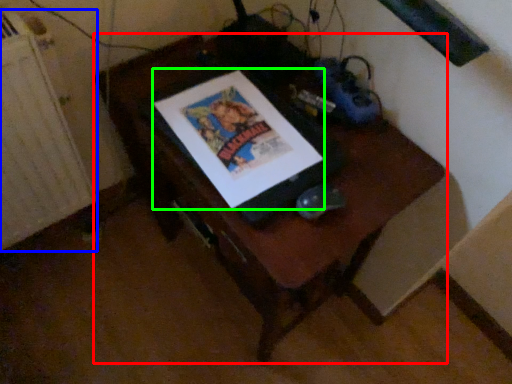
Question: Based on their relative distances, which object is nearer to furniture (highlighted by a red box)? Choose from radiator (highlighted by a blue box) and comic book (highlighted by a green box).

Choices:
 (A) radiator
 (B) comic book

Answer: (B)